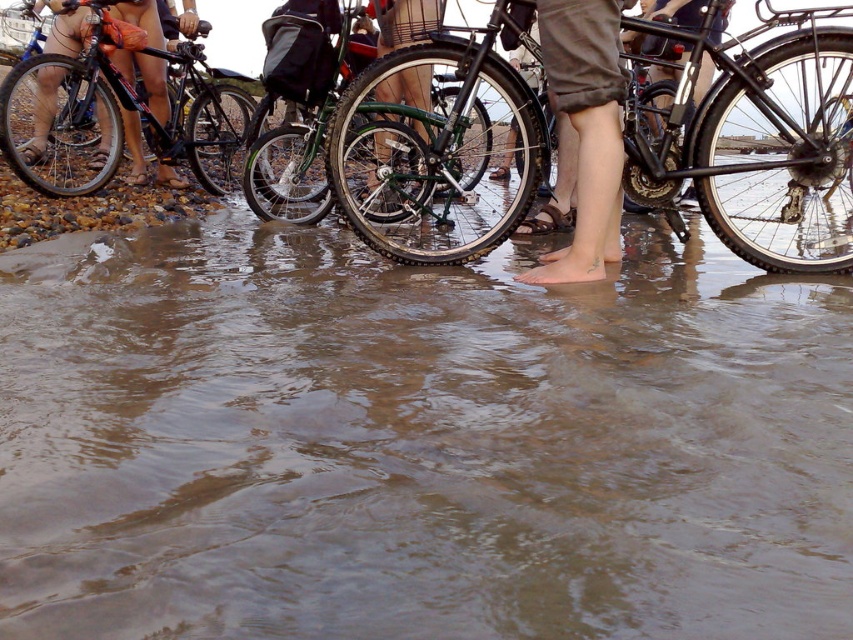
Does point (38, 76) come farther from viewer compared to point (419, 124)?

Yes, point (38, 76) is behind point (419, 124).

Who is more distant from viewer, (x=32, y=76) or (x=431, y=76)?

The point (x=32, y=76) is behind.

Image resolution: width=853 pixels, height=640 pixels. What are the coordinates of `shiny black bicycle at upper left` in the screenshot? It's located at (125, 120).

Is point (189, 160) positioned behind point (578, 84)?

Yes, it is.

Can you confirm if shiny black bicycle at upper left is positioned to the right of skinny jeans at lower center?

No, shiny black bicycle at upper left is not to the right of skinny jeans at lower center.

This screenshot has height=640, width=853. What do you see at coordinates (125, 120) in the screenshot? I see `shiny black bicycle at upper left` at bounding box center [125, 120].

You are a GUI agent. You are given a task and a screenshot of the screen. Output one action in this format:
    pyautogui.click(x=<x>, y=<y>)
    Task: Click on the shiny black bicycle at upper left
    The width and height of the screenshot is (853, 640).
    Given the screenshot: What is the action you would take?
    pyautogui.click(x=125, y=120)

Is brown murky water at center wider than skinny jeans at lower center?

Yes.

Who is taller, brown murky water at center or skinny jeans at lower center?

Standing taller between the two is skinny jeans at lower center.

Is point (668, 467) behind point (607, 108)?

No, (668, 467) is in front of (607, 108).

Locate an element on the screen. The image size is (853, 640). brown murky water at center is located at coordinates (419, 444).